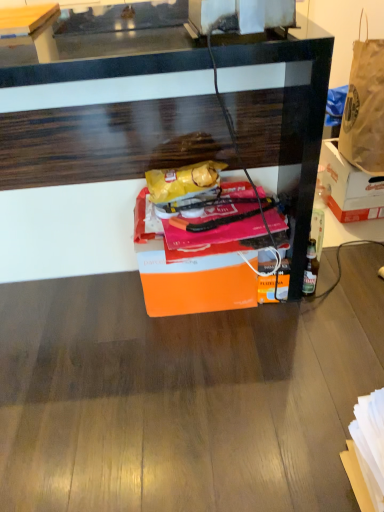
Question: Is orange cardboard box at right, acting as the first box starting from the back, located outside brown paper bag at upper right?

Choices:
 (A) no
 (B) yes

Answer: (B)

Question: Can you confirm if orange cardboard box at right, positioned as the first box in right-to-left order, is bigger than brown paper bag at upper right?

Choices:
 (A) yes
 (B) no

Answer: (B)

Question: Could brown paper bag at upper right be considered to be inside orange cardboard box at right, acting as the first box starting from the back?

Choices:
 (A) no
 (B) yes

Answer: (A)

Question: Is brown paper bag at upper right at the back of orange cardboard box at right, positioned as the first box in right-to-left order?

Choices:
 (A) yes
 (B) no

Answer: (B)

Question: Can you confirm if orange cardboard box at right, the second box positioned from the left, is taller than brown paper bag at upper right?

Choices:
 (A) yes
 (B) no

Answer: (B)

Question: Considering the relative positions of orange cardboard box at right, marked as the 2th box in a front-to-back arrangement, and orange matte box at center, which is the 2th box in right-to-left order, in the image provided, is orange cardboard box at right, marked as the 2th box in a front-to-back arrangement, to the left or to the right of orange matte box at center, which is the 2th box in right-to-left order,?

Choices:
 (A) left
 (B) right

Answer: (B)

Question: Is point (332, 194) positioned closer to the camera than point (218, 301)?

Choices:
 (A) closer
 (B) farther

Answer: (B)

Question: Would you say orange cardboard box at right, marked as the 2th box in a front-to-back arrangement, is inside or outside orange matte box at center, which is the 2th box in right-to-left order?

Choices:
 (A) outside
 (B) inside

Answer: (A)

Question: Is orange cardboard box at right, the second box positioned from the left, bigger or smaller than orange matte box at center, which is the 2th box in right-to-left order?

Choices:
 (A) big
 (B) small

Answer: (B)

Question: Which is correct: orange matte box at center, which is the 2th box in right-to-left order, is inside brown paper bag at upper right, or outside of it?

Choices:
 (A) outside
 (B) inside

Answer: (A)

Question: From the image's perspective, is orange matte box at center, the 1th box positioned from the left, located above or below brown paper bag at upper right?

Choices:
 (A) below
 (B) above

Answer: (A)

Question: Is orange matte box at center, which ranks as the second box in back-to-front order, wider or thinner than brown paper bag at upper right?

Choices:
 (A) wide
 (B) thin

Answer: (A)

Question: Looking at the image, does orange matte box at center, which is the 2th box in right-to-left order, seem bigger or smaller compared to brown paper bag at upper right?

Choices:
 (A) big
 (B) small

Answer: (B)

Question: From the image's perspective, is orange matte box at center, which is the 2th box in right-to-left order, located above or below orange cardboard box at right, acting as the first box starting from the back?

Choices:
 (A) below
 (B) above

Answer: (A)

Question: From a real-world perspective, is orange matte box at center, arranged as the 1th box when viewed from the front, positioned above or below orange cardboard box at right, acting as the first box starting from the back?

Choices:
 (A) below
 (B) above

Answer: (B)